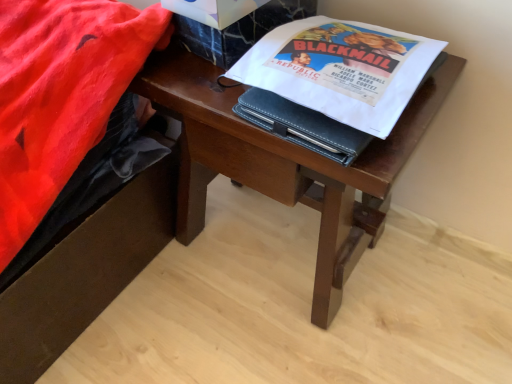
Question: Looking at their shapes, would you say white paper at upper center is wider or thinner than wooden desk at center?

Choices:
 (A) thin
 (B) wide

Answer: (A)

Question: Is white paper at upper center taller or shorter than wooden desk at center?

Choices:
 (A) tall
 (B) short

Answer: (B)

Question: Is point (409, 77) positioned closer to the camera than point (374, 175)?

Choices:
 (A) closer
 (B) farther

Answer: (B)

Question: From a real-world perspective, is wooden desk at center physically located above or below white paper at upper center?

Choices:
 (A) above
 (B) below

Answer: (B)

Question: Considering the positions of wooden desk at center and white paper at upper center in the image, is wooden desk at center bigger or smaller than white paper at upper center?

Choices:
 (A) small
 (B) big

Answer: (B)

Question: From the image's perspective, relative to white paper at upper center, is wooden desk at center above or below?

Choices:
 (A) below
 (B) above

Answer: (A)

Question: Is wooden desk at center inside or outside of white paper at upper center?

Choices:
 (A) outside
 (B) inside

Answer: (A)